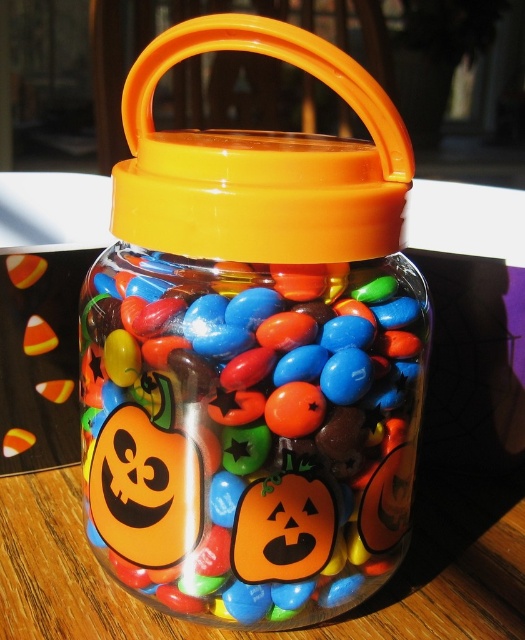
Where is the glossy plastic jar at center located in the image?

The glossy plastic jar at center is located at point (250, 429) in the image.